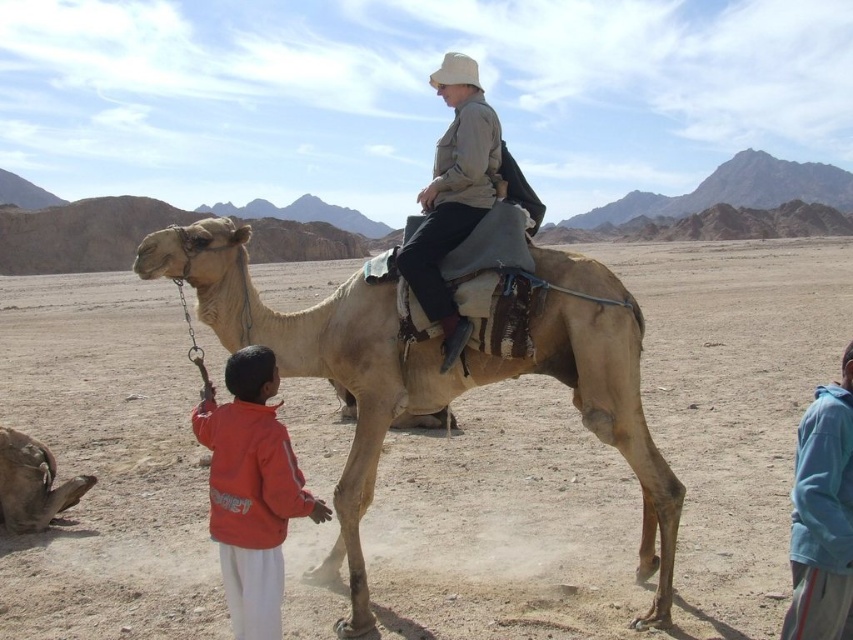
Looking at this image, how far apart are beige rough camel at center and red fleece jacket at lower left?

The distance of beige rough camel at center from red fleece jacket at lower left is 2.33 meters.

Is beige rough camel at center thinner than red fleece jacket at lower left?

Yes, beige rough camel at center is thinner than red fleece jacket at lower left.

This screenshot has height=640, width=853. I want to click on beige rough camel at center, so click(436, 376).

Can you confirm if red fleece jacket at lower left is taller than light brown leather camel at lower left?

Indeed, red fleece jacket at lower left has a greater height compared to light brown leather camel at lower left.

Find the location of `red fleece jacket at lower left`. red fleece jacket at lower left is located at coordinates point(251,490).

Between point (242, 468) and point (12, 465), which one is positioned behind?

Positioned behind is point (12, 465).

Find the location of a particular element. This screenshot has width=853, height=640. red fleece jacket at lower left is located at coordinates (251, 490).

Is beige rough camel at center smaller than light brown leather camel at lower left?

Correct, beige rough camel at center occupies less space than light brown leather camel at lower left.

Is beige rough camel at center further to the viewer compared to light brown leather camel at lower left?

No, it is not.

Does point (625, 328) come in front of point (19, 476)?

Yes.

Identify the location of beige rough camel at center. The width and height of the screenshot is (853, 640). (436, 376).